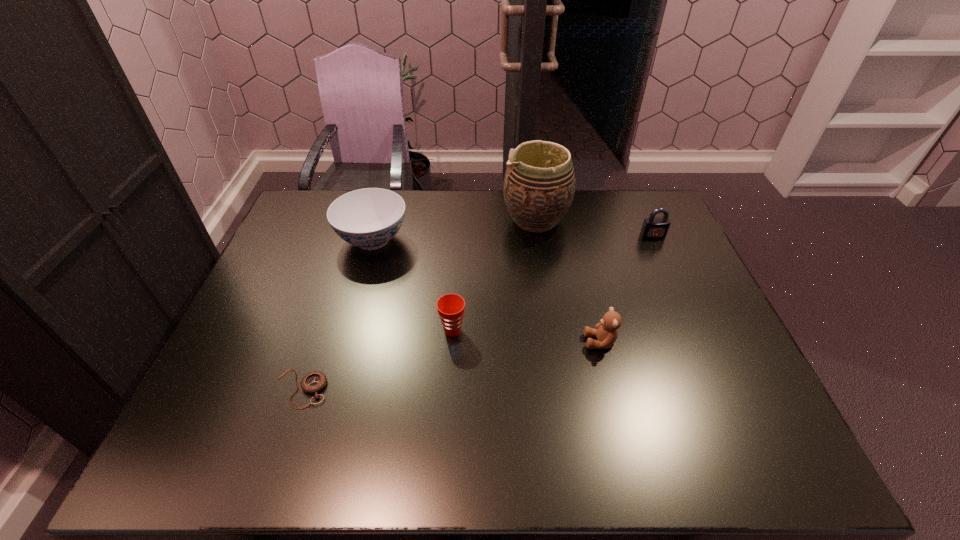
The height and width of the screenshot is (540, 960). In the image, there is a desktop. What are the coordinates of `free space at the near edge` in the screenshot? It's located at (276, 441).

Find the location of `free space at the left edge of the desktop`. free space at the left edge of the desktop is located at coordinates (264, 308).

In the image, there is a desktop. Identify the location of vacant space at the right edge. This screenshot has width=960, height=540. pyautogui.click(x=684, y=288).

At what (x,y) coordinates should I click in order to perform the action: click on free space at the far right corner of the desktop. Please return your answer as a coordinate pair (x, y). Looking at the image, I should click on (644, 218).

The width and height of the screenshot is (960, 540). In the image, there is a desktop. Find the location of `free space at the near right corner`. free space at the near right corner is located at coordinates (767, 440).

You are a GUI agent. You are given a task and a screenshot of the screen. Output one action in this format:
    pyautogui.click(x=<x>, y=<y>)
    Task: Click on the free spot between the pottery and the teddy bear
    
    Given the screenshot: What is the action you would take?
    pyautogui.click(x=568, y=281)

At what (x,y) coordinates should I click in order to perform the action: click on free spot between the padlock and the tallest object. Please return your answer as a coordinate pair (x, y). Looking at the image, I should click on (594, 228).

You are a GUI agent. You are given a task and a screenshot of the screen. Output one action in this format:
    pyautogui.click(x=<x>, y=<y>)
    Task: Click on the free spot between the chinaware and the pocket watch
    The width and height of the screenshot is (960, 540).
    Given the screenshot: What is the action you would take?
    pyautogui.click(x=337, y=314)

Image resolution: width=960 pixels, height=540 pixels. Find the location of `free space that is in between the pottery and the pocket watch`. free space that is in between the pottery and the pocket watch is located at coordinates (419, 305).

Where is `free space between the pocket watch and the chinaware`? This screenshot has width=960, height=540. free space between the pocket watch and the chinaware is located at coordinates (337, 314).